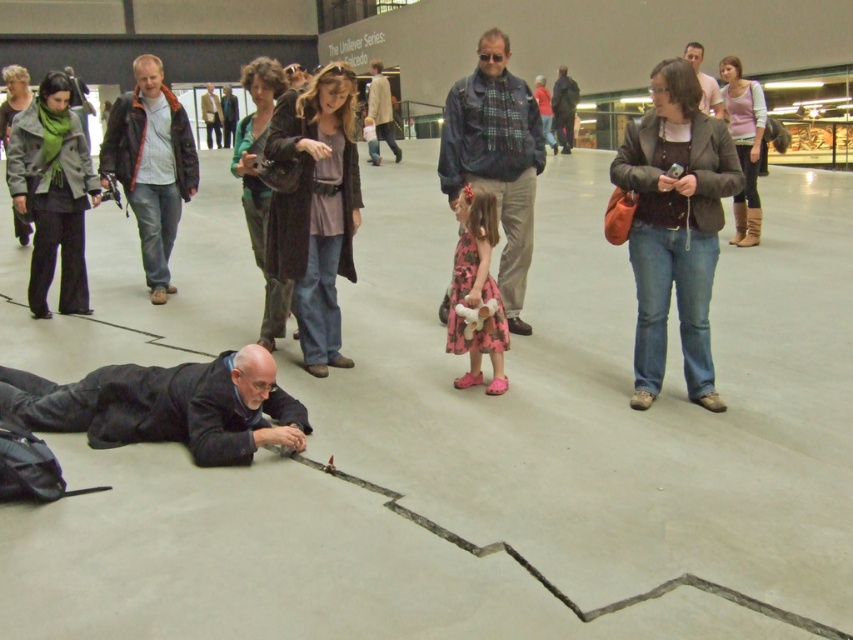
Question: Which object is the farthest from the dark blue fabric at lower left?

Choices:
 (A) denim jeans at center
 (B) dark blue jacket at center
 (C) matte black jacket at center
 (D) dark blue jacket at upper center

Answer: (D)

Question: Can you confirm if denim jeans at center is thinner than dark blue jacket at upper center?

Choices:
 (A) yes
 (B) no

Answer: (B)

Question: Among these objects, which one is farthest from the camera?

Choices:
 (A) brown leather jacket at center
 (B) dark blue jacket at upper center

Answer: (B)

Question: Does denim jeans at center come behind dark blue jacket at center?

Choices:
 (A) no
 (B) yes

Answer: (A)

Question: Observing the image, what is the correct spatial positioning of denim jeans at center in reference to brown leather jacket at center?

Choices:
 (A) right
 (B) left

Answer: (A)

Question: Which of these objects is positioned closest to the dark blue fabric at lower left?

Choices:
 (A) denim jeans at center
 (B) pink floral dress at center

Answer: (A)